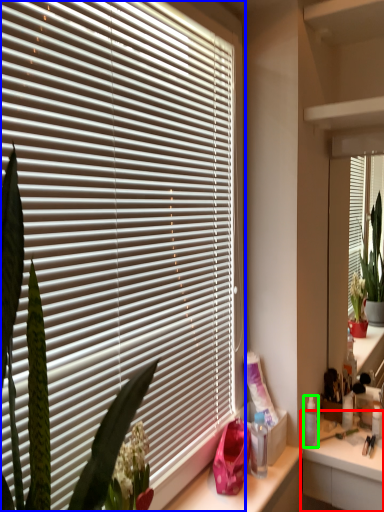
Question: Estimate the real-world distances between objects in this image. Which object is closer to counter (highlighted by a red box), window blind (highlighted by a blue box) or toiletry (highlighted by a green box)?

Choices:
 (A) window blind
 (B) toiletry

Answer: (B)